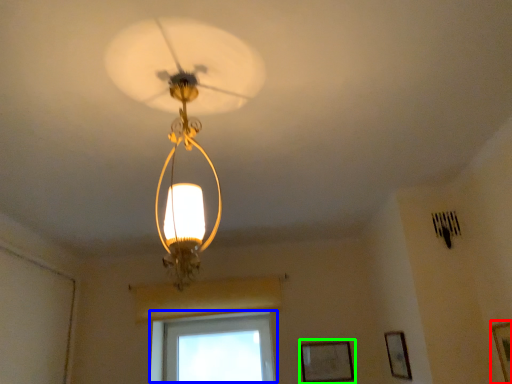
Question: Which object is the closest to the picture frame (highlighted by a red box)? Choose among these: window (highlighted by a blue box) or picture frame (highlighted by a green box).

Choices:
 (A) window
 (B) picture frame

Answer: (B)